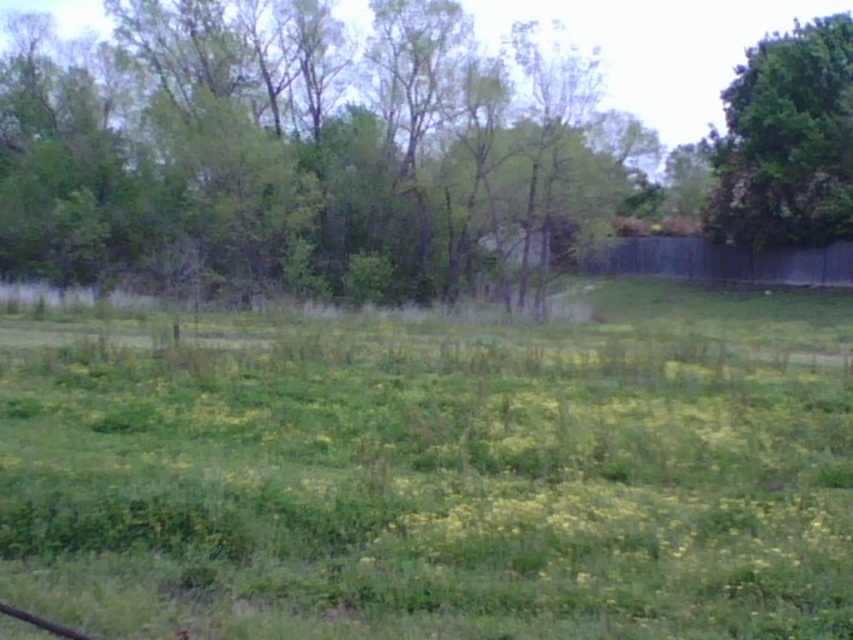
Between green grassy field at center and green leafy tree at upper right, which one has less height?

Standing shorter between the two is green grassy field at center.

Where is `green grassy field at center`? The image size is (853, 640). green grassy field at center is located at coordinates (437, 472).

This screenshot has height=640, width=853. Identify the location of green grassy field at center. (437, 472).

Identify the location of green grassy field at center. (437, 472).

Which of these two, green leafy tree at upper center or green leafy tree at upper right, stands shorter?

With less height is green leafy tree at upper right.

Is green leafy tree at upper center wider than green leafy tree at upper right?

Yes, green leafy tree at upper center is wider than green leafy tree at upper right.

At what (x,y) coordinates should I click in order to perform the action: click on green leafy tree at upper center. Please return your answer as a coordinate pair (x, y). The width and height of the screenshot is (853, 640). Looking at the image, I should click on (308, 147).

This screenshot has height=640, width=853. Identify the location of green leafy tree at upper center. (308, 147).

Who is more forward, (28, 554) or (80, 170)?

Point (28, 554) is in front.

Can you confirm if green grassy field at center is thinner than green leafy tree at upper center?

Yes, green grassy field at center is thinner than green leafy tree at upper center.

Locate an element on the screen. The height and width of the screenshot is (640, 853). green grassy field at center is located at coordinates [437, 472].